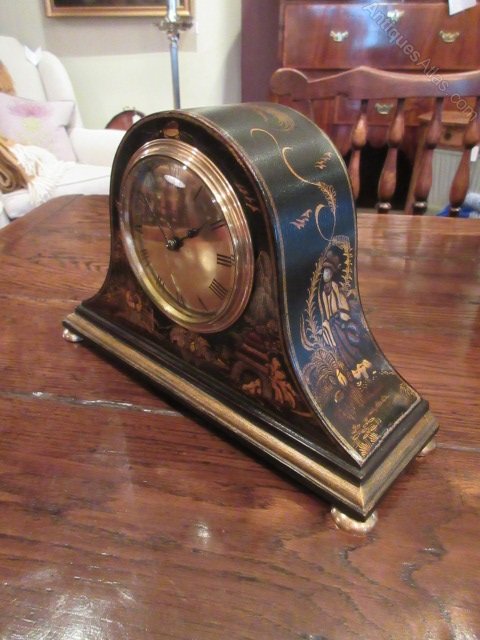
Image resolution: width=480 pixels, height=640 pixels. Find the location of `face of the clock`. face of the clock is located at coordinates (189, 217).